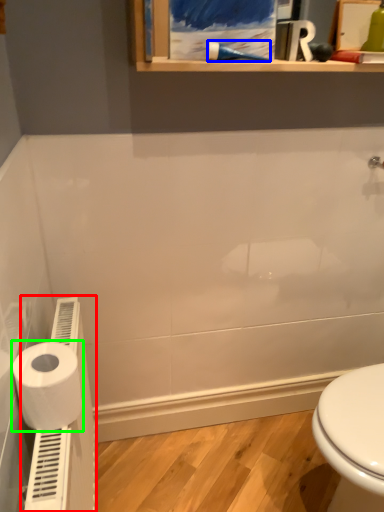
Question: Which object is positioned farthest from water heater (highlighted by a red box)? Select from shower (highlighted by a blue box) and toilet paper (highlighted by a green box).

Choices:
 (A) shower
 (B) toilet paper

Answer: (A)